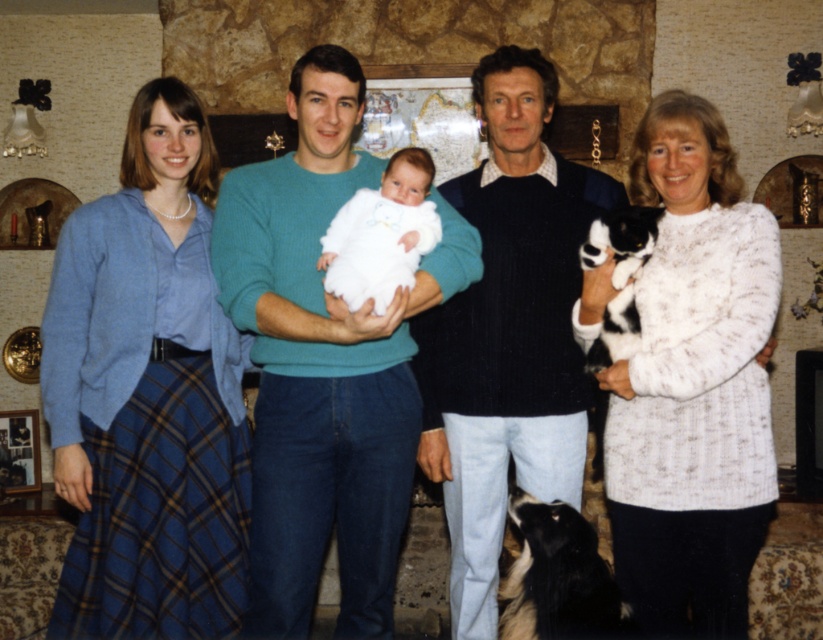
Question: Is blue plaid skirt at left further to camera compared to white fluffy baby at center?

Choices:
 (A) yes
 (B) no

Answer: (A)

Question: Which of the following is the closest to the observer?

Choices:
 (A) black and white fur at lower right
 (B) green knitted sweater at center

Answer: (A)

Question: Where is white knitted sweater at right located in relation to black fur dog at right in the image?

Choices:
 (A) right
 (B) left

Answer: (A)

Question: Estimate the real-world distances between objects in this image. Which object is closer to the white fluffy baby at center?

Choices:
 (A) white knitted sweater at right
 (B) black and white fur at lower right
 (C) black fur dog at right
 (D) dark blue sweater at center

Answer: (D)

Question: Which point is closer to the camera?

Choices:
 (A) blue plaid skirt at left
 (B) white fluffy baby at center
 (C) green knitted sweater at center

Answer: (B)

Question: Can you confirm if white knitted sweater at right is wider than dark blue sweater at center?

Choices:
 (A) no
 (B) yes

Answer: (B)